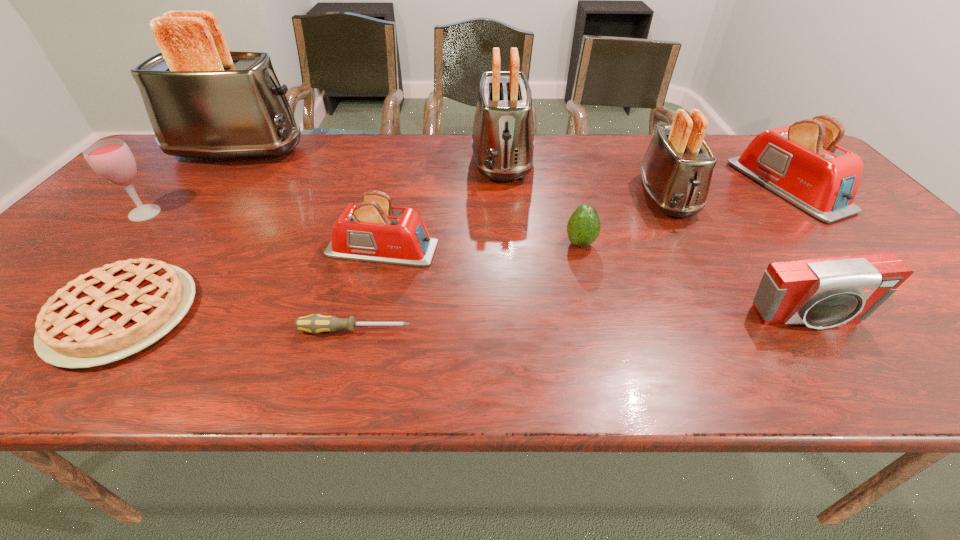
Identify which object is the eighth nearest to the second toaster from left to right. Please provide its 2D coordinates. Your answer should be formatted as a tuple, i.e. [(x, y)], where the tuple contains the x and y coordinates of a point satisfying the conditions above.

[(822, 293)]

Identify which toaster is located as the second nearest to the third toaster from right to left. Please provide its 2D coordinates. Your answer should be formatted as a tuple, i.e. [(x, y)], where the tuple contains the x and y coordinates of a point satisfying the conditions above.

[(677, 168)]

Locate an element on the screen. toaster identified as the closest to the camera is located at coordinates (800, 162).

You are a GUI agent. You are given a task and a screenshot of the screen. Output one action in this format:
    pyautogui.click(x=<x>, y=<y>)
    Task: Click on the gray toaster that is the closest to the smaller red toaster
    
    Given the screenshot: What is the action you would take?
    pyautogui.click(x=503, y=143)

Find the location of a particular element. gray toaster that can be found as the second closest to the camera is located at coordinates (503, 143).

You are a GUI agent. You are given a task and a screenshot of the screen. Output one action in this format:
    pyautogui.click(x=<x>, y=<y>)
    Task: Click on the vacant space that satisfies the following two spatial constraints: 1. on the side of the second smallest gray toaster with the control lever; 2. at the tip of the shortest object
    Image resolution: width=960 pixels, height=540 pixels.
    Given the screenshot: What is the action you would take?
    pyautogui.click(x=515, y=330)

The image size is (960, 540). I want to click on free region that satisfies the following two spatial constraints: 1. on the front side of the green avocado; 2. at the tip of the gray screwdriver, so click(602, 330).

Identify the location of vacant space that satisfies the following two spatial constraints: 1. on the back side of the rightmost toaster; 2. on the left side of the green avocado. (565, 186).

Where is `free point that satisfies the following two spatial constraints: 1. on the side of the tallest object with the control lever; 2. on the front side of the wineglass`? The height and width of the screenshot is (540, 960). free point that satisfies the following two spatial constraints: 1. on the side of the tallest object with the control lever; 2. on the front side of the wineglass is located at coordinates (189, 213).